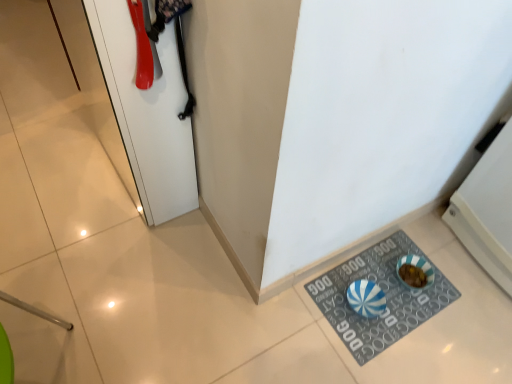
I want to click on free location in front of blue and white striped rubber mat at lower right, so click(390, 362).